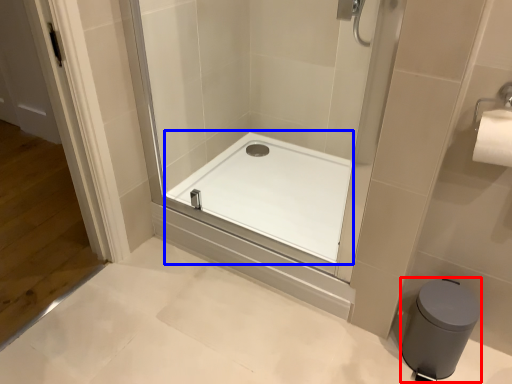
Question: Among these objects, which one is farthest to the camera, bidet (highlighted by a red box) or bath (highlighted by a blue box)?

Choices:
 (A) bidet
 (B) bath

Answer: (B)